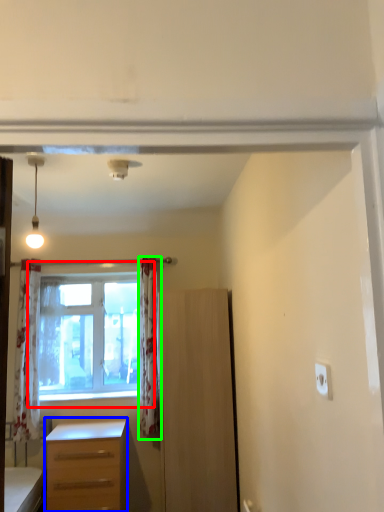
Question: Based on their relative distances, which object is nearer to window (highlighted by a red box)? Choose from desk (highlighted by a blue box) and curtain (highlighted by a green box).

Choices:
 (A) desk
 (B) curtain

Answer: (B)